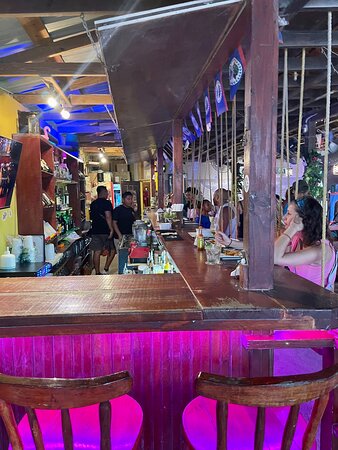
The image size is (338, 450). Find the location of `glass`. glass is located at coordinates (214, 257).